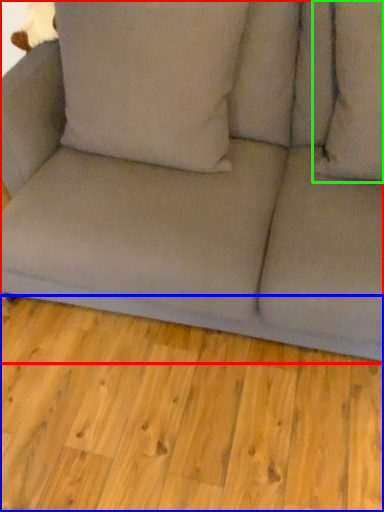
Question: Based on their relative distances, which object is farther from studio couch (highlighted by a red box)? Choose from plank (highlighted by a blue box) and pillow (highlighted by a green box).

Choices:
 (A) plank
 (B) pillow

Answer: (A)